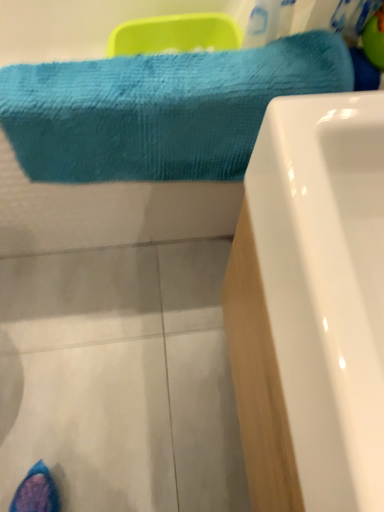
Question: Considering the positions of point (281, 48) and point (349, 415), is point (281, 48) closer or farther from the camera than point (349, 415)?

Choices:
 (A) closer
 (B) farther

Answer: (B)

Question: Considering the positions of turquoise textured towel at upper left and white glossy bathtub at lower right in the image, is turquoise textured towel at upper left bigger or smaller than white glossy bathtub at lower right?

Choices:
 (A) big
 (B) small

Answer: (B)

Question: Based on their positions, is turquoise textured towel at upper left located to the left or right of white glossy bathtub at lower right?

Choices:
 (A) left
 (B) right

Answer: (A)

Question: Is white glossy bathtub at lower right inside or outside of turquoise textured towel at upper left?

Choices:
 (A) inside
 (B) outside

Answer: (B)

Question: Considering the positions of white glossy bathtub at lower right and turquoise textured towel at upper left in the image, is white glossy bathtub at lower right bigger or smaller than turquoise textured towel at upper left?

Choices:
 (A) big
 (B) small

Answer: (A)

Question: From a real-world perspective, is white glossy bathtub at lower right positioned above or below turquoise textured towel at upper left?

Choices:
 (A) below
 (B) above

Answer: (A)

Question: Looking at their shapes, would you say white glossy bathtub at lower right is wider or thinner than turquoise textured towel at upper left?

Choices:
 (A) wide
 (B) thin

Answer: (B)